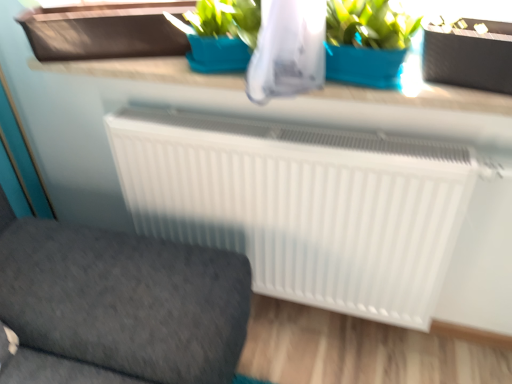
Question: Is the depth of brown matte window box at upper left less than that of white plastic radiator at center?

Choices:
 (A) yes
 (B) no

Answer: (B)

Question: Is brown matte window box at upper left oriented towards white plastic radiator at center?

Choices:
 (A) yes
 (B) no

Answer: (A)

Question: Is brown matte window box at upper left to the right of white plastic radiator at center from the viewer's perspective?

Choices:
 (A) no
 (B) yes

Answer: (B)

Question: From a real-world perspective, is brown matte window box at upper left physically above white plastic radiator at center?

Choices:
 (A) no
 (B) yes

Answer: (B)

Question: Is brown matte window box at upper left shorter than white plastic radiator at center?

Choices:
 (A) yes
 (B) no

Answer: (A)

Question: Is white plastic radiator at center taller or shorter than black matte flowerpot at upper right?

Choices:
 (A) short
 (B) tall

Answer: (B)

Question: Does point (186, 258) appear closer or farther from the camera than point (433, 51)?

Choices:
 (A) closer
 (B) farther

Answer: (B)

Question: Is white plastic radiator at center situated inside black matte flowerpot at upper right or outside?

Choices:
 (A) outside
 (B) inside

Answer: (A)

Question: Is white plastic radiator at center to the left or to the right of black matte flowerpot at upper right in the image?

Choices:
 (A) left
 (B) right

Answer: (A)

Question: Considering the positions of brown matte window box at upper left and white plastic radiator at center in the image, is brown matte window box at upper left taller or shorter than white plastic radiator at center?

Choices:
 (A) tall
 (B) short

Answer: (B)

Question: In the image, is brown matte window box at upper left positioned in front of or behind white plastic radiator at center?

Choices:
 (A) behind
 (B) front

Answer: (A)

Question: From a real-world perspective, relative to white plastic radiator at center, is brown matte window box at upper left vertically above or below?

Choices:
 (A) below
 (B) above

Answer: (B)

Question: Looking at their shapes, would you say brown matte window box at upper left is wider or thinner than white plastic radiator at center?

Choices:
 (A) wide
 (B) thin

Answer: (B)

Question: Is white plastic radiator at center inside or outside of white smooth counter top at upper center?

Choices:
 (A) outside
 (B) inside

Answer: (A)

Question: In terms of height, does white plastic radiator at center look taller or shorter compared to white smooth counter top at upper center?

Choices:
 (A) tall
 (B) short

Answer: (A)